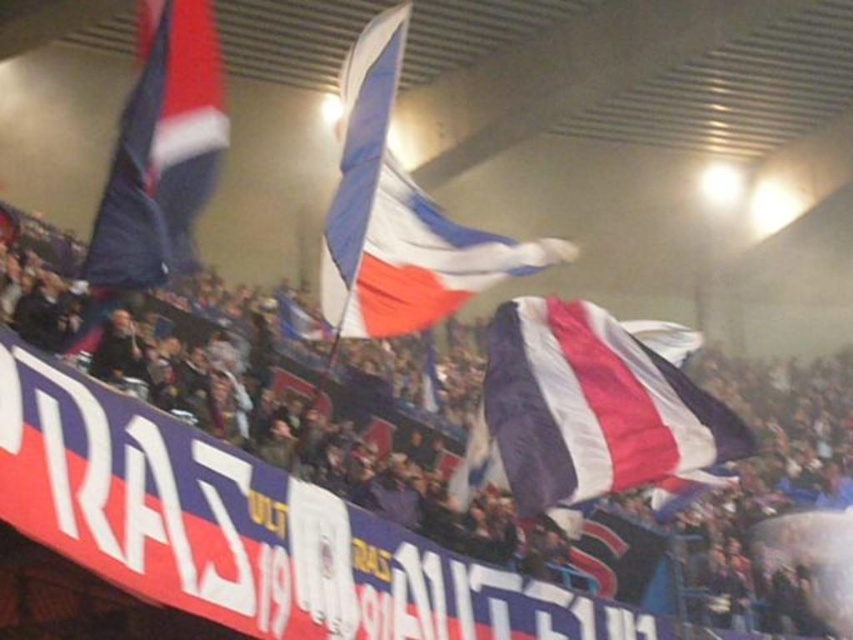
Consider the image. You are a photographer standing at the front row of the stadium. You want to take a photo of the textured fabric flags at center. Where should you aim your camera to capture them?

You should aim your camera at point (273,528) to capture the textured fabric flags at center as their 2D location is at that coordinate.

You are a photographer at the stadium and want to capture both the matte fabric flag at center and the white fabric flag at center in a single shot. Which flag should you position your camera to the left of to ensure both are in frame?

To capture both the matte fabric flag at center and the white fabric flag at center in a single shot, position your camera to the left of the matte fabric flag at center. Since the matte fabric flag at center is to the right of the white fabric flag at center, this positioning will ensure both flags are included in the frame.

You are a photographer standing at the edge of the stadium field. You want to capture a closeup shot of the textured fabric flags at center. Given that your camera can focus on objects up to 100 feet away, will you be able to take the photo without moving closer?

The textured fabric flags at center are 108.44 feet away from the camera. Since your camera can only focus up to 100 feet, you will need to move closer to take the closeup shot.